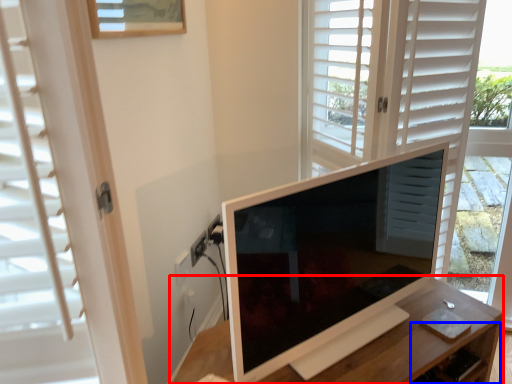
Question: Which object is closer to the camera taking this photo, table (highlighted by a red box) or drawer (highlighted by a blue box)?

Choices:
 (A) table
 (B) drawer

Answer: (A)